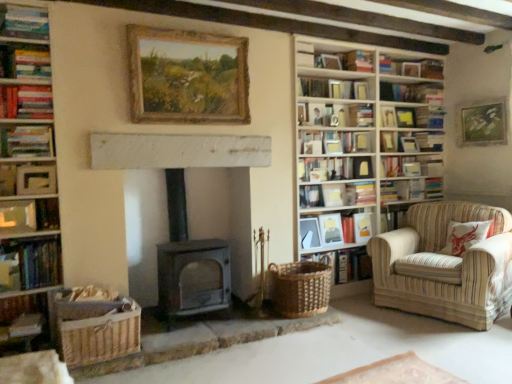
Find the location of a particular element. This screenshot has height=384, width=512. vacant region above wooden-framed painting at upper center, which appears as the 1th picture frame when viewed from the top (from a real-world perspective) is located at coordinates (187, 31).